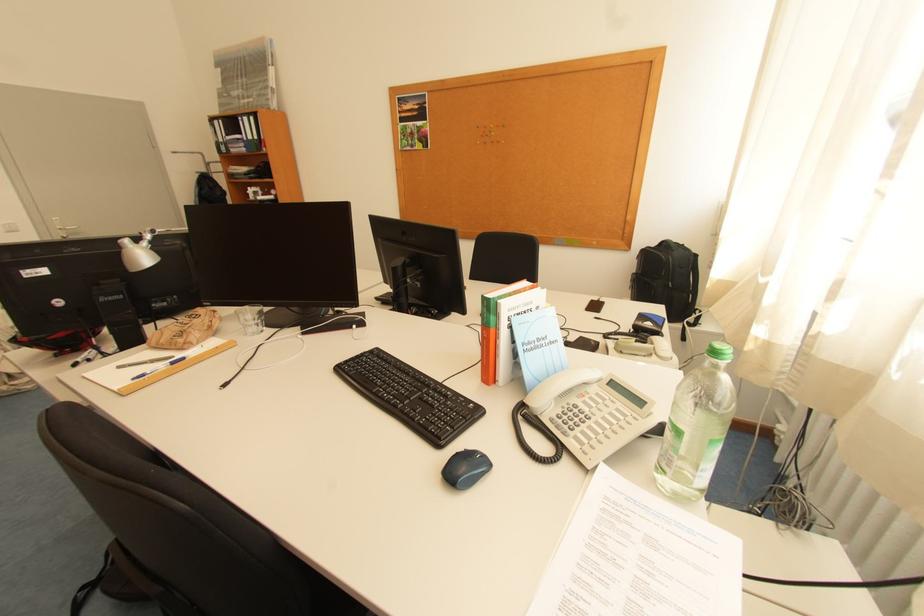
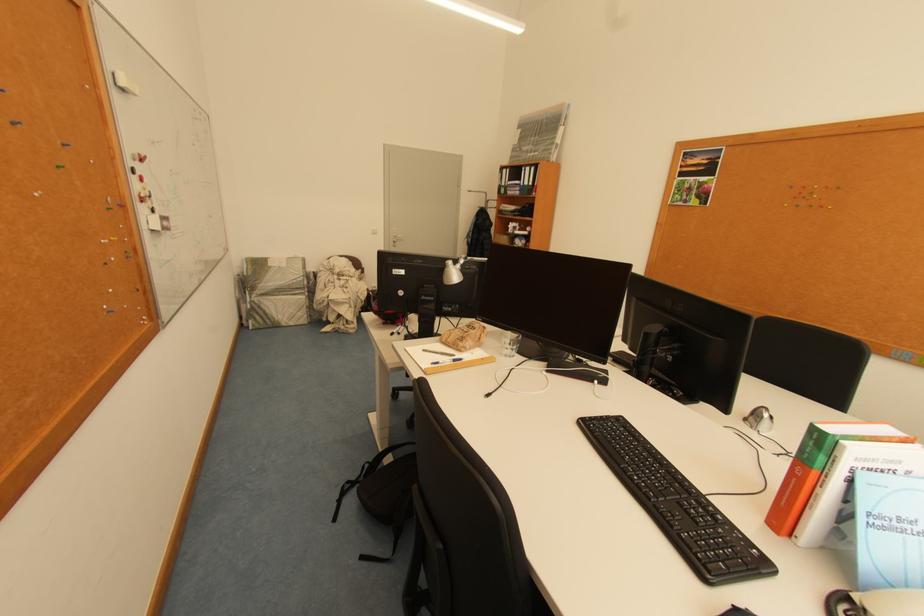
In the second image, find the point that corresponds to point 508,305 in the first image.

(853, 448)